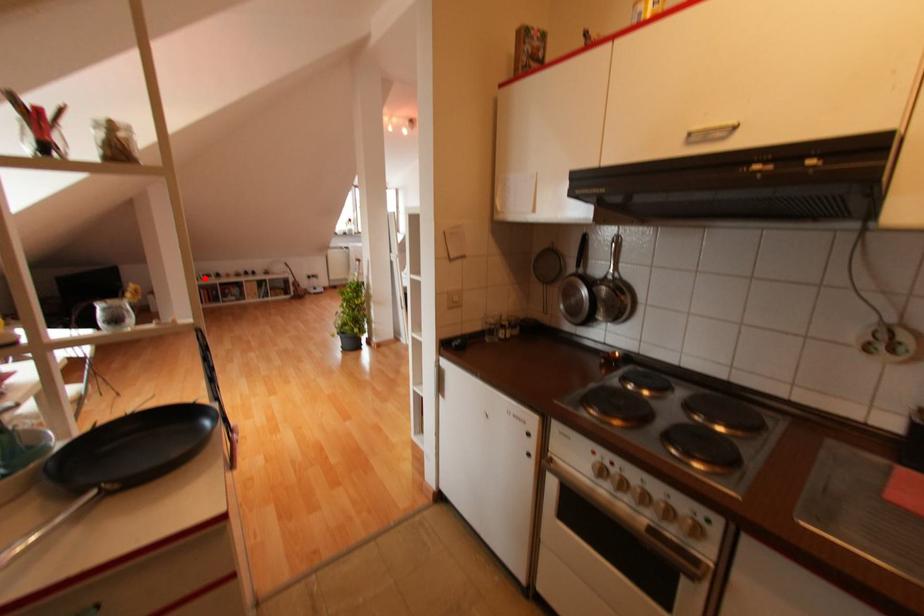
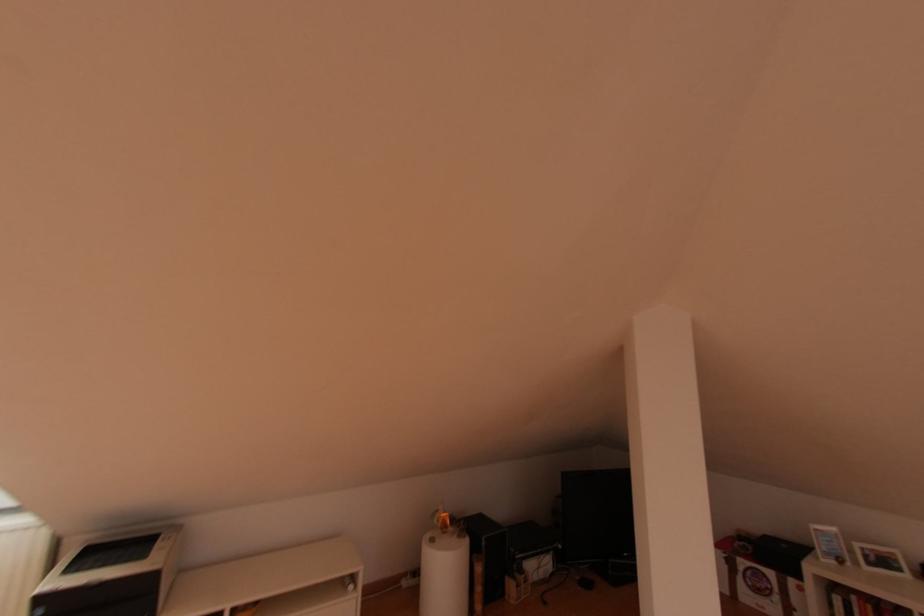
Where in the second image is the point corresponding to the highlighted location from the first image?

(869, 564)